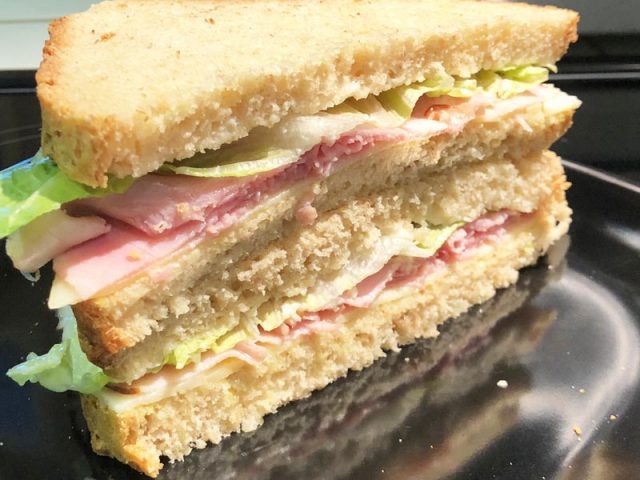
At what (x,y) coordinates should I click in order to perform the action: click on rim of tray. Please return your answer as a coordinate pair (x, y). This screenshot has width=640, height=480. Looking at the image, I should click on (594, 170).